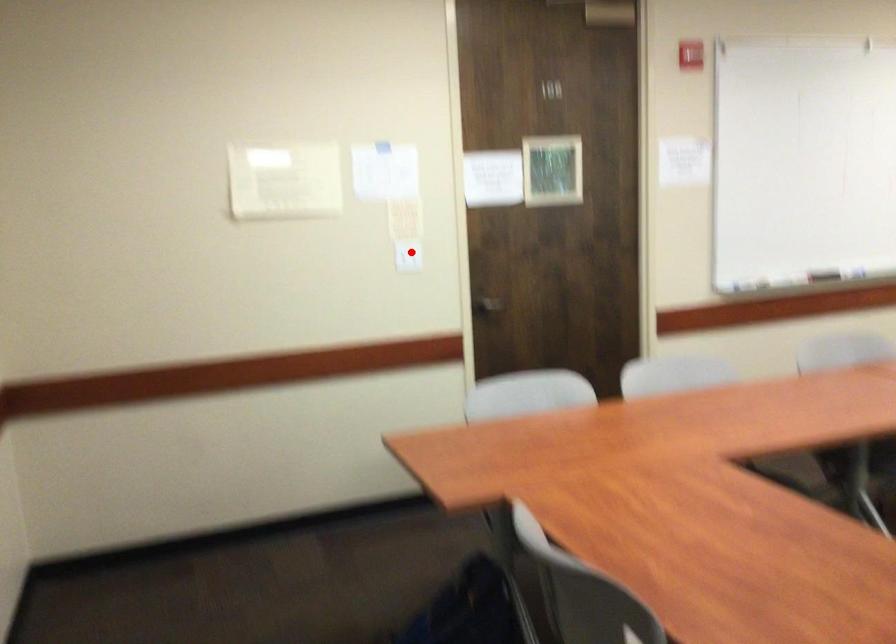
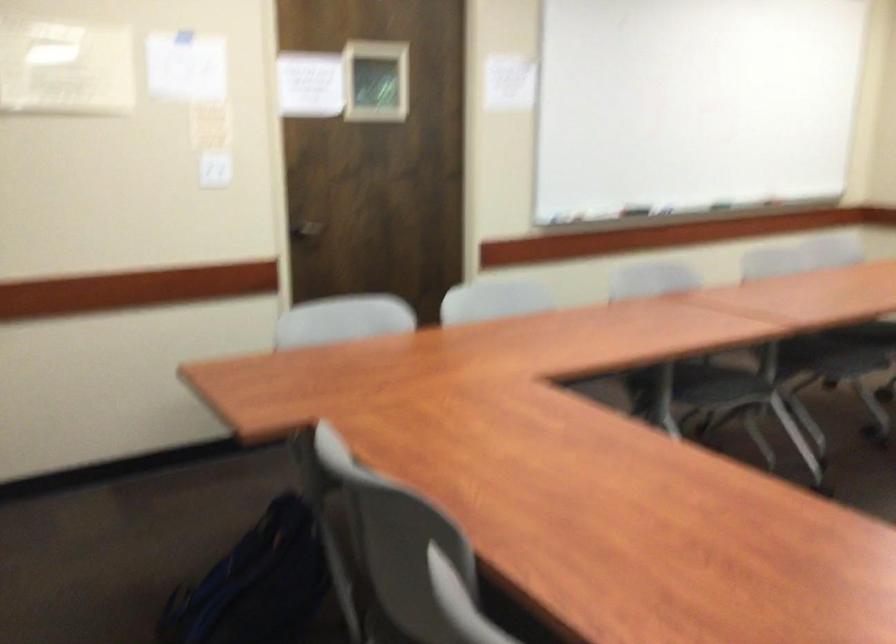
Locate, in the second image, the point that corresponds to the highlighted location in the first image.

(214, 169)